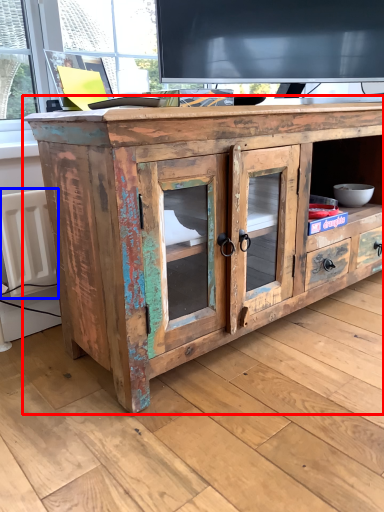
Question: Which point is closer to the camera, chest of drawers (highlighted by a red box) or radiator (highlighted by a blue box)?

Choices:
 (A) chest of drawers
 (B) radiator

Answer: (A)